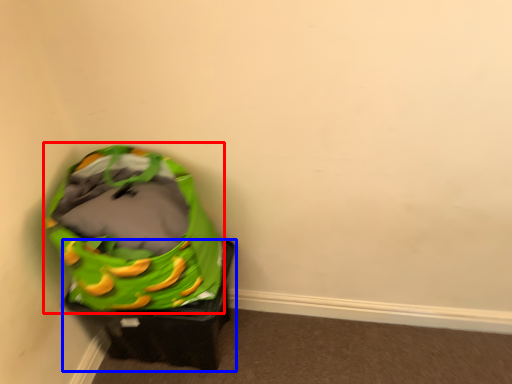
Question: Which point is closer to the camera, bean bag chair (highlighted by a red box) or furniture (highlighted by a blue box)?

Choices:
 (A) bean bag chair
 (B) furniture

Answer: (A)